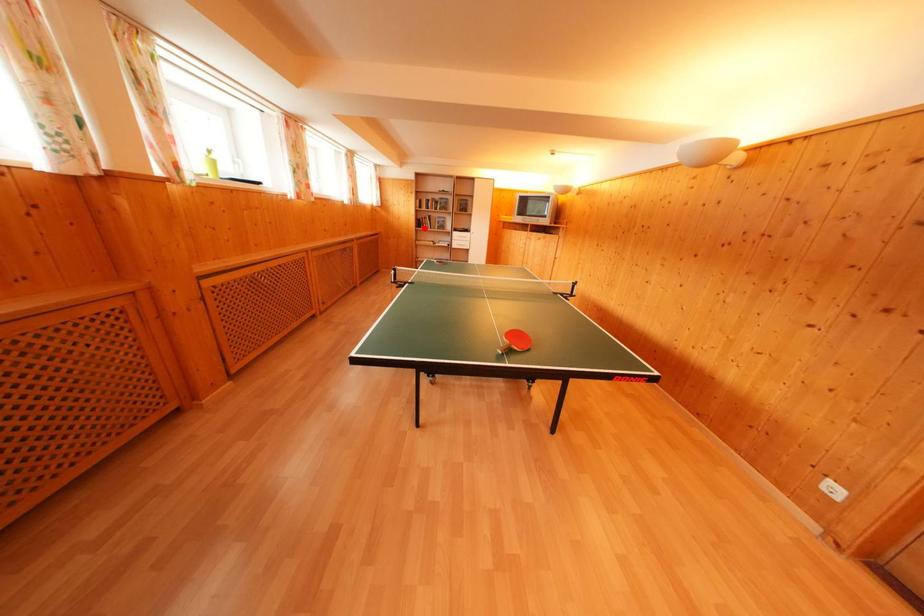
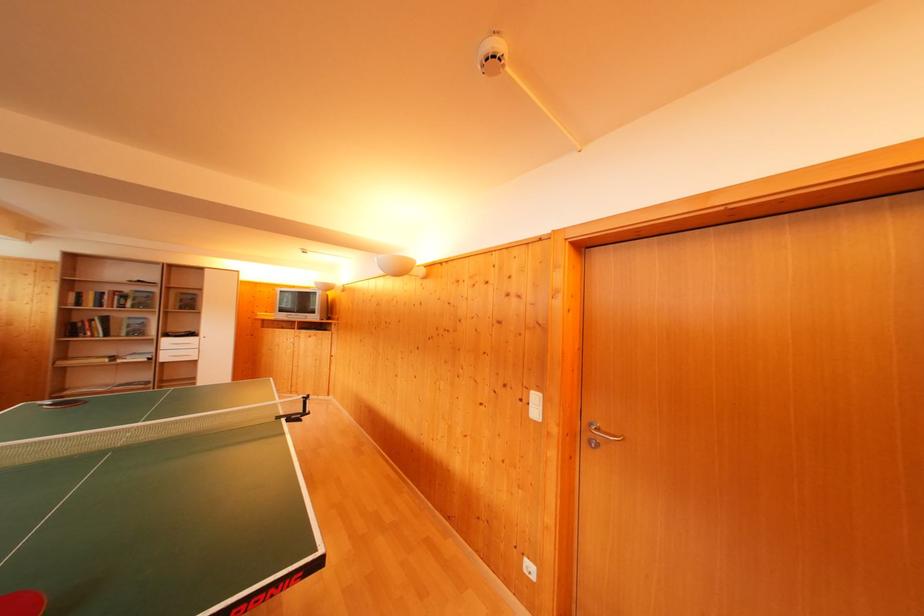
Locate, in the second image, the point that corresponds to the highlighted location in the first image.

(76, 334)